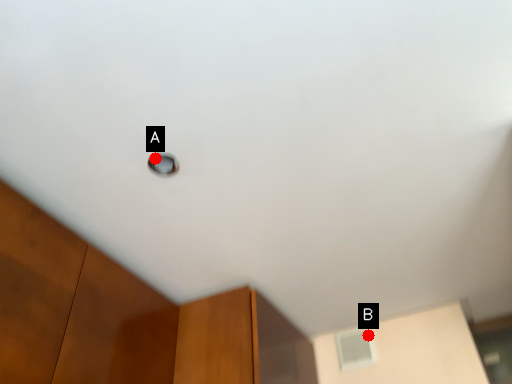
Question: Two points are circled on the image, labeled by A and B beside each circle. Which point appears farthest from the camera in this image?

Choices:
 (A) A is further
 (B) B is further

Answer: (B)